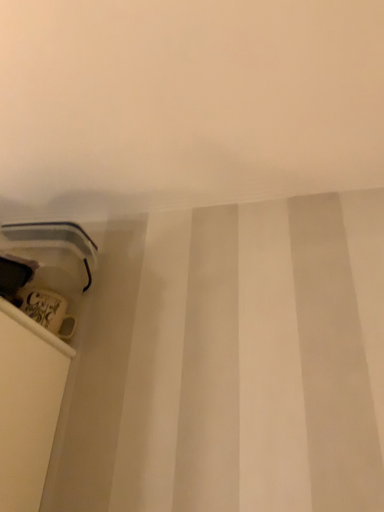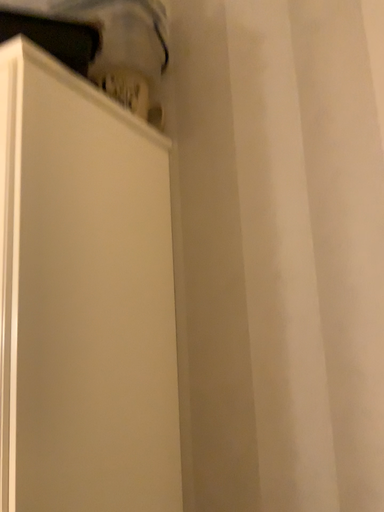
Question: How did the camera likely rotate when shooting the video?

Choices:
 (A) rotated downward
 (B) rotated upward

Answer: (A)